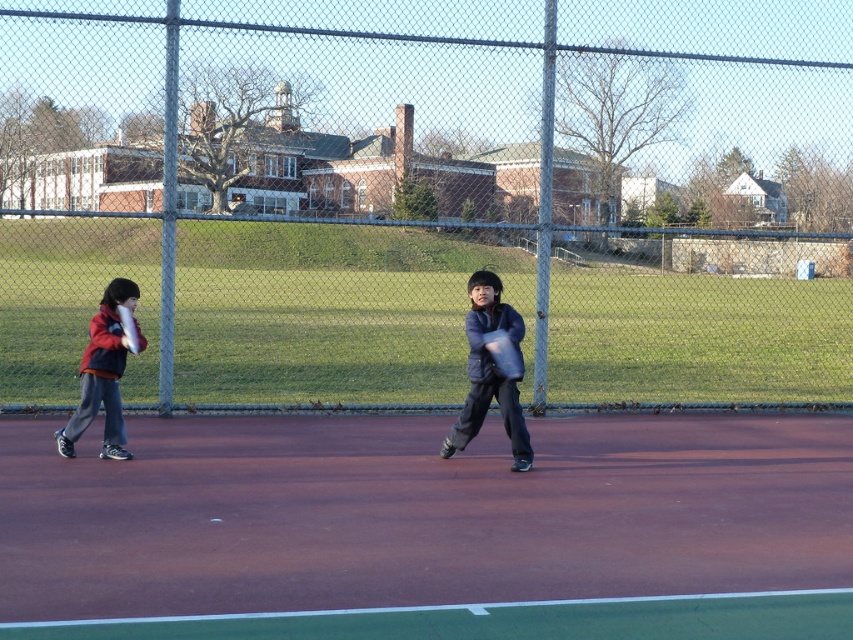
You are a photographer standing behind the two children on the tennis court. You want to take a photo that includes both the red fleece jacket at left and the translucent white racket at left. Given that your camera has a fixed focus, which object should you focus on to ensure both are in focus considering their sizes?

The red fleece jacket at left is larger in width than the translucent white racket at left, so focusing on the jacket will help ensure both are in focus as it is the larger object closer to the camera.